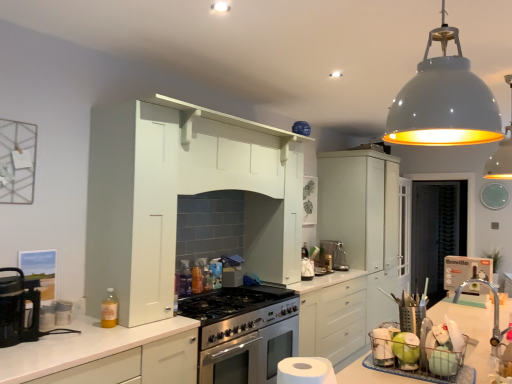
You are a GUI agent. You are given a task and a screenshot of the screen. Output one action in this format:
    pyautogui.click(x=<x>, y=<y>)
    Task: Click on the black plastic coffee maker at left
    Image resolution: width=512 pixels, height=384 pixels.
    Given the screenshot: What is the action you would take?
    pyautogui.click(x=17, y=309)

What do you see at coordinates (17, 309) in the screenshot?
I see `black plastic coffee maker at left` at bounding box center [17, 309].

In order to face translucent yellow bottle at lower left, should I rotate leftwards or rightwards?

Rotate your view left by about 18.899°.

In order to face matte white cabinet at center-right, which is the 1th cabinetry from right to left, should I rotate leftwards or rightwards?

Turn right by 13.819 degrees to look at matte white cabinet at center-right, which is the 1th cabinetry from right to left.

At what (x,y) coordinates should I click in order to perform the action: click on white glossy pendant lamp at upper right, the 1th light fixture positioned from the front. Please return your answer as a coordinate pair (x, y). The width and height of the screenshot is (512, 384). Looking at the image, I should click on (444, 101).

What is the approximate height of stainless steel oven at center?

stainless steel oven at center is 27.34 inches in height.

Find the location of a particular element. Image resolution: width=512 pixels, height=384 pixels. satin silver coffee machine at center is located at coordinates (333, 254).

The height and width of the screenshot is (384, 512). Identify the location of white matte cabinet at lower left, which is counted as the first cabinetry, starting from the front. point(139,364).

The width and height of the screenshot is (512, 384). In order to click on cabinetry below the satin silver coffee machine at center (from a real-world perspective) in this screenshot , I will do `click(139, 364)`.

Is satin silver coffee machine at center facing towards white matte cabinet at lower left, which is counted as the first cabinetry, starting from the front?

No, satin silver coffee machine at center is not aimed at white matte cabinet at lower left, which is counted as the first cabinetry, starting from the front.

Is satin silver coffee machine at center to the left of white matte cabinet at lower left, the second cabinetry from the right, from the viewer's perspective?

In fact, satin silver coffee machine at center is to the right of white matte cabinet at lower left, the second cabinetry from the right.

Which point is more distant from viewer, (343, 268) or (89, 378)?

The point (343, 268) is more distant.

Looking at this image, do you think satin silver coffee machine at center is within white glossy pendant lamp at upper right, the 1th light fixture viewed from the left, or outside of it?

satin silver coffee machine at center is spatially situated outside white glossy pendant lamp at upper right, the 1th light fixture viewed from the left.

From a real-world perspective, between satin silver coffee machine at center and white glossy pendant lamp at upper right, which is counted as the second light fixture, starting from the right, who is vertically lower?

satin silver coffee machine at center.

How different are the orientations of stainless steel oven at center and translucent yellow bottle at lower left in degrees?

The angular difference between stainless steel oven at center and translucent yellow bottle at lower left is 0.293 degrees.

Is there a large distance between stainless steel oven at center and translucent yellow bottle at lower left?

They are positioned close to each other.

Would you say translucent yellow bottle at lower left is part of stainless steel oven at center's contents?

No, translucent yellow bottle at lower left is located outside of stainless steel oven at center.

Is stainless steel oven at center positioned with its back to translucent yellow bottle at lower left?

stainless steel oven at center does not have its back to translucent yellow bottle at lower left.

Consider the image. From a real-world perspective, is stainless steel oven at center physically located above or below matte white cabinet at center-right, which ranks as the first cabinetry in back-to-front order?

From a real-world perspective, stainless steel oven at center is physically below matte white cabinet at center-right, which ranks as the first cabinetry in back-to-front order.

Would you consider stainless steel oven at center to be distant from matte white cabinet at center-right, which ranks as the second cabinetry in front-to-back order?

That's right, there is a large distance between stainless steel oven at center and matte white cabinet at center-right, which ranks as the second cabinetry in front-to-back order.

Identify the location of cabinetry that appears on the right of stainless steel oven at center. (x=362, y=220).

In the scene shown: From the image's perspective, is stainless steel oven at center under matte white cabinet at center-right, which ranks as the second cabinetry in front-to-back order?

Yes.

The image size is (512, 384). Find the location of `bottle on the left of satin silver kettle at center`. bottle on the left of satin silver kettle at center is located at coordinates (109, 310).

Are translucent yellow bottle at lower left and satin silver kettle at center making contact?

translucent yellow bottle at lower left and satin silver kettle at center are clearly separated.

From the picture: From the image's perspective, relative to satin silver kettle at center, is translucent yellow bottle at lower left above or below?

Clearly, from the image's perspective, translucent yellow bottle at lower left is above satin silver kettle at center.

From a real-world perspective, is satin silver coffee machine at center on white matte dome at upper center, which ranks as the 1th light fixture in back-to-front order?

No, from a real-world perspective, satin silver coffee machine at center is not on top of white matte dome at upper center, which ranks as the 1th light fixture in back-to-front order.

Is satin silver coffee machine at center wider or thinner than white matte dome at upper center, which ranks as the 1th light fixture in back-to-front order?

satin silver coffee machine at center is thinner than white matte dome at upper center, which ranks as the 1th light fixture in back-to-front order.

Is satin silver coffee machine at center positioned with its back to white matte dome at upper center, which ranks as the 1th light fixture in back-to-front order?

No.

Between translucent yellow bottle at lower left and white matte cabinet at lower left, which is the 2th cabinetry from back to front, which one has smaller size?

With smaller size is translucent yellow bottle at lower left.

Where is `bottle that appears above the white matte cabinet at lower left, which is counted as the first cabinetry, starting from the front (from a real-world perspective)`? The image size is (512, 384). bottle that appears above the white matte cabinet at lower left, which is counted as the first cabinetry, starting from the front (from a real-world perspective) is located at coordinates (109, 310).

Is translucent yellow bottle at lower left at the right side of white matte cabinet at lower left, which is counted as the first cabinetry, starting from the front?

Indeed, translucent yellow bottle at lower left is positioned on the right side of white matte cabinet at lower left, which is counted as the first cabinetry, starting from the front.

Based on the photo, which is in front, translucent yellow bottle at lower left or white matte cabinet at lower left, which is the 2th cabinetry from back to front?

white matte cabinet at lower left, which is the 2th cabinetry from back to front, is more forward.

Where is `cabinetry that appears below the satin silver coffee machine at center (from the image's perspective)`? The height and width of the screenshot is (384, 512). cabinetry that appears below the satin silver coffee machine at center (from the image's perspective) is located at coordinates (139, 364).

Where is `the 2nd light fixture above the satin silver coffee machine at center (from the image's perspective)`? the 2nd light fixture above the satin silver coffee machine at center (from the image's perspective) is located at coordinates (444, 101).

Considering their positions, is black plastic coffee maker at left positioned closer to white matte dome at upper center, which ranks as the 1th light fixture in back-to-front order, than stainless steel oven at center?

stainless steel oven at center lies closer to white matte dome at upper center, which ranks as the 1th light fixture in back-to-front order, than the other object.

Looking at the image, which one is located further to satin silver kettle at center, black plastic coffee maker at left or satin silver coffee machine at center?

The object further to satin silver kettle at center is black plastic coffee maker at left.

From the image, which object appears to be nearer to stainless steel oven at center, satin silver kettle at center or white matte dome at upper center, which ranks as the 1th light fixture in back-to-front order?

Among the two, satin silver kettle at center is located nearer to stainless steel oven at center.

From the image, which object appears to be nearer to satin silver coffee machine at center, matte white cabinet at center-right, marked as the second cabinetry in a left-to-right arrangement, or satin silver kettle at center?

satin silver kettle at center is positioned closer to the anchor satin silver coffee machine at center.

In the scene shown: Based on their spatial positions, is black plastic coffee maker at left or white matte cabinet at lower left, which ranks as the 1th cabinetry in left-to-right order, closer to white glossy pendant lamp at upper right, the 1th light fixture positioned from the front?

The object closer to white glossy pendant lamp at upper right, the 1th light fixture positioned from the front, is white matte cabinet at lower left, which ranks as the 1th cabinetry in left-to-right order.

Which object lies nearer to the anchor point white matte cabinet at lower left, the second cabinetry from the right, satin silver kettle at center or matte white cabinet at center-right, which is the 1th cabinetry from right to left?

satin silver kettle at center.

Estimate the real-world distances between objects in this image. Which object is further from stainless steel oven at center, translucent yellow bottle at lower left or satin silver coffee machine at center?

Among the two, satin silver coffee machine at center is located further to stainless steel oven at center.

Considering their positions, is white matte cabinet at lower left, which is counted as the first cabinetry, starting from the front, positioned closer to white matte dome at upper center, which ranks as the 2th light fixture in left-to-right order, than matte white cabinet at center-right, marked as the second cabinetry in a left-to-right arrangement?

Among the two, matte white cabinet at center-right, marked as the second cabinetry in a left-to-right arrangement, is located nearer to white matte dome at upper center, which ranks as the 2th light fixture in left-to-right order.

Find the location of a particular element. Image resolution: width=512 pixels, height=384 pixels. oven between black plastic coffee maker at left and matte white cabinet at center-right, which ranks as the first cabinetry in back-to-front order, from front to back is located at coordinates (250, 355).

Where is `kitchen appliance between white matte cabinet at lower left, which ranks as the 1th cabinetry in left-to-right order, and satin silver kettle at center, along the z-axis`? The image size is (512, 384). kitchen appliance between white matte cabinet at lower left, which ranks as the 1th cabinetry in left-to-right order, and satin silver kettle at center, along the z-axis is located at coordinates (17, 309).

Where is `oven between translucent yellow bottle at lower left and matte white cabinet at center-right, which ranks as the second cabinetry in front-to-back order, in the front-back direction`? oven between translucent yellow bottle at lower left and matte white cabinet at center-right, which ranks as the second cabinetry in front-to-back order, in the front-back direction is located at coordinates (250, 355).

Identify the location of appliance between white matte dome at upper center, which ranks as the 2th light fixture in left-to-right order, and satin silver coffee machine at center in the front-back direction. (328, 263).